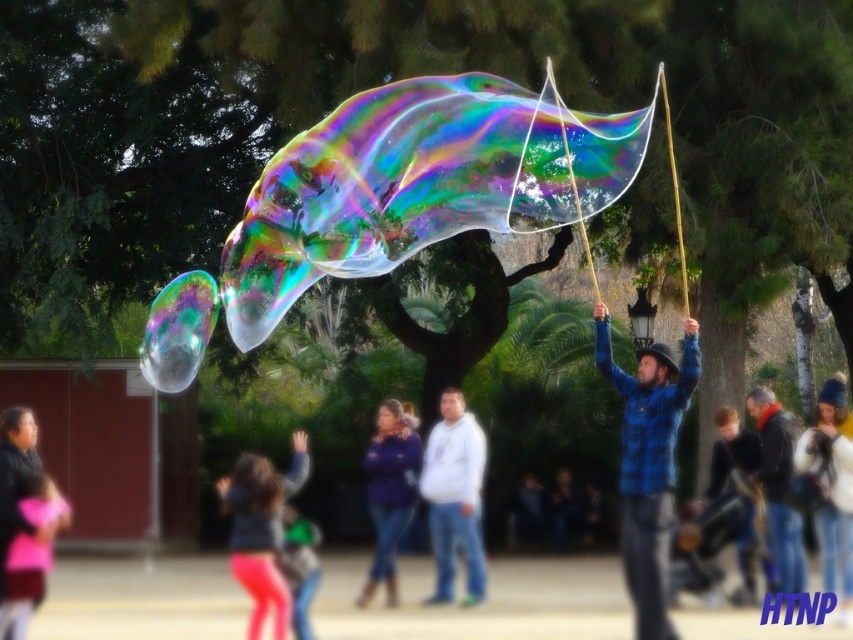
Question: Can you confirm if pink fabric pants at lower left is smaller than blue denim jeans at center?

Choices:
 (A) yes
 (B) no

Answer: (B)

Question: Considering the relative positions of white matte hoodie at center and pink fabric at lower left in the image provided, where is white matte hoodie at center located with respect to pink fabric at lower left?

Choices:
 (A) above
 (B) below

Answer: (B)

Question: Among these points, which one is farthest from the camera?

Choices:
 (A) (395, 582)
 (B) (666, 378)

Answer: (A)

Question: Estimate the real-world distances between objects in this image. Which object is closer to the white matte hoodie at center?

Choices:
 (A) dark blue flannel shirt at center
 (B) pink fabric pants at lower left

Answer: (B)

Question: Is white matte hoodie at center behind pink fabric pants at lower left?

Choices:
 (A) no
 (B) yes

Answer: (B)

Question: Which point is closer to the camera taking this photo?

Choices:
 (A) (668, 435)
 (B) (466, 433)
 (C) (25, 557)

Answer: (C)